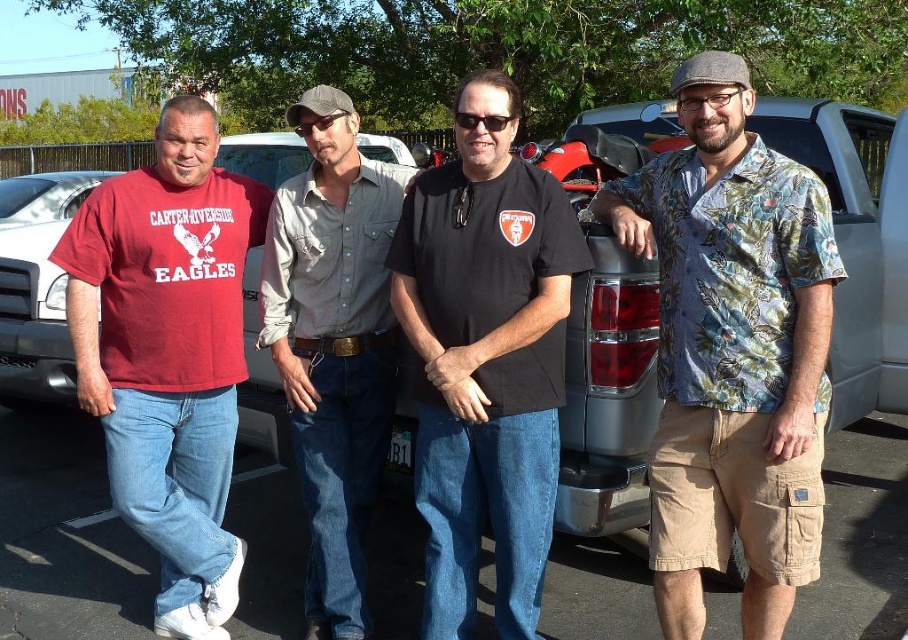
Describe the element at coordinates (168, 353) in the screenshot. This screenshot has height=640, width=908. I see `matte red t-shirt at left` at that location.

Between matte red t-shirt at left and denim jeans at center, which one appears on the left side from the viewer's perspective?

matte red t-shirt at left is more to the left.

Which is in front, point (201, 493) or point (364, 252)?

Point (364, 252) is in front.

You are a GUI agent. You are given a task and a screenshot of the screen. Output one action in this format:
    pyautogui.click(x=<x>, y=<y>)
    Task: Click on the matte red t-shirt at left
    
    Given the screenshot: What is the action you would take?
    pyautogui.click(x=168, y=353)

Is point (284, 380) closer to viewer compared to point (697, 84)?

No, it is not.

Can you confirm if denim jeans at center is positioned below glossy plastic glasses at upper center?

Yes.

Is point (321, 218) farther from viewer compared to point (709, 99)?

That is True.

Locate an element on the screen. denim jeans at center is located at coordinates (333, 340).

Which is behind, point (454, 248) or point (492, 125)?

The point (454, 248) is behind.

Who is taller, black matte t-shirt at center or black plastic sunglasses at center?

With more height is black matte t-shirt at center.

Where is `black matte t-shirt at center`? black matte t-shirt at center is located at coordinates (485, 360).